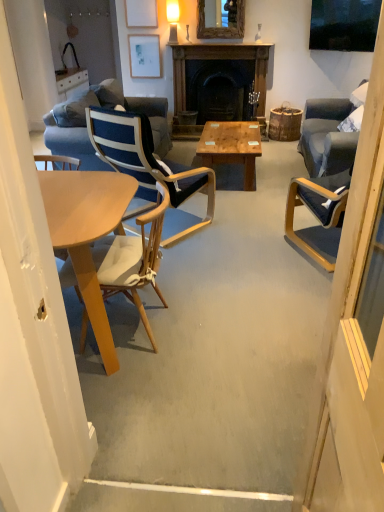
I want to click on vacant space in front of natural wood chair at left, the second chair viewed from the back, so click(135, 389).